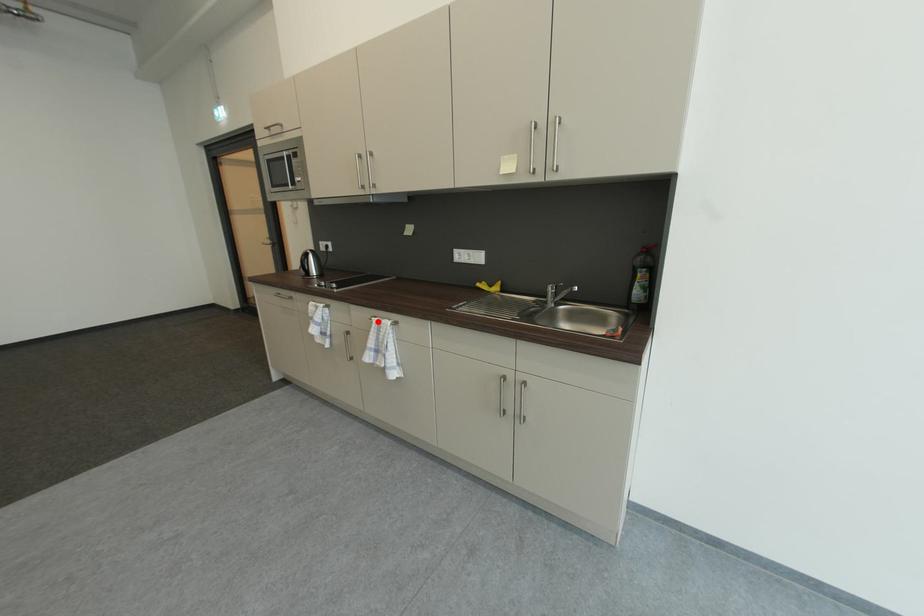
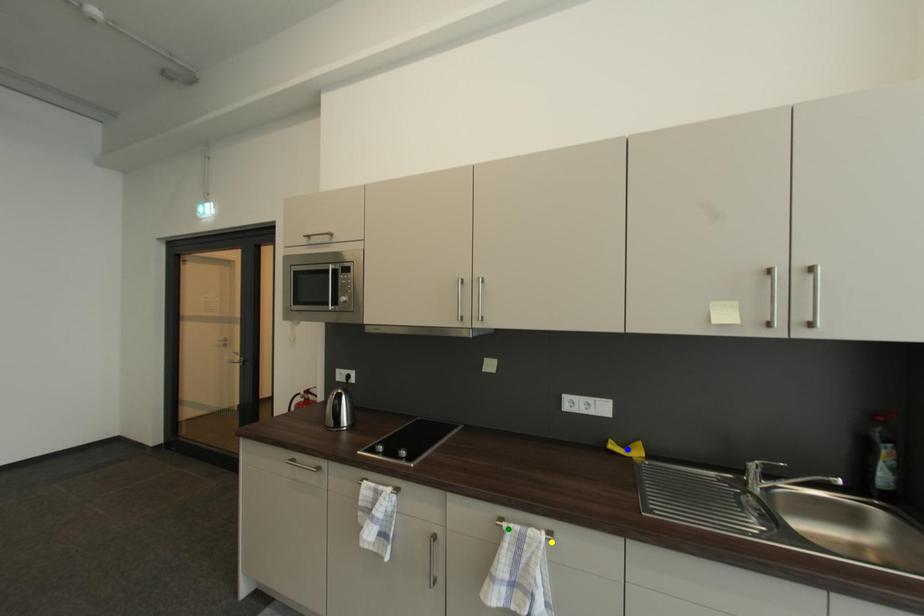
Question: I am providing you with two images of the same scene from different viewpoints. A red point is marked on the first image. You are given multiple points on the second image. Which point in image 2 is actually the same real-world point as the red point in image 1?

Choices:
 (A) yellow point
 (B) blue point
 (C) green point

Answer: (C)